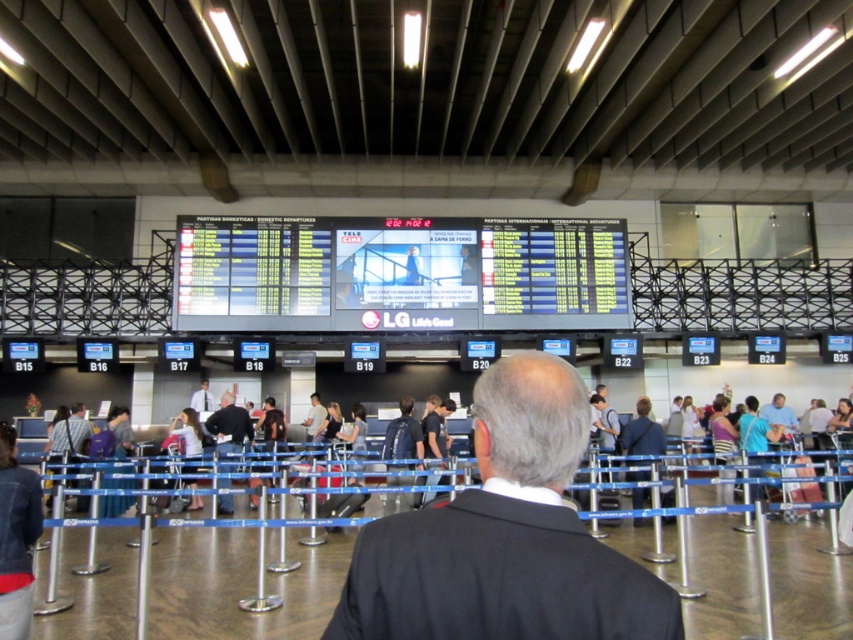
You are an airport security officer and you need to store both the black suit coat at center and the light brown leather jacket at center in a rectangular locker that is 30 cm wide. Which item will not fit in the locker if the locker can only accommodate items up to 30 cm in width?

The black suit coat at center has a greater width than the light brown leather jacket at center. Since the locker can only accommodate items up to 30 cm in width, the black suit coat at center may not fit if its width exceeds 30 cm, while the light brown leather jacket at center would fit as it is narrower.

Looking at this image, you are standing in the airport terminal and see the striped shirt at left and the light brown leather jacket at center. Which clothing item is nearer to you?

The striped shirt at left is closer to the viewer than the light brown leather jacket at center.

You are standing in the airport terminal and want to know which of the two points, point (503, 616) or point (74, 451), is closer to you. Based on the flight information display board, can you determine which point is nearer?

Point (503, 616) is closer to the viewer than point (74, 451).